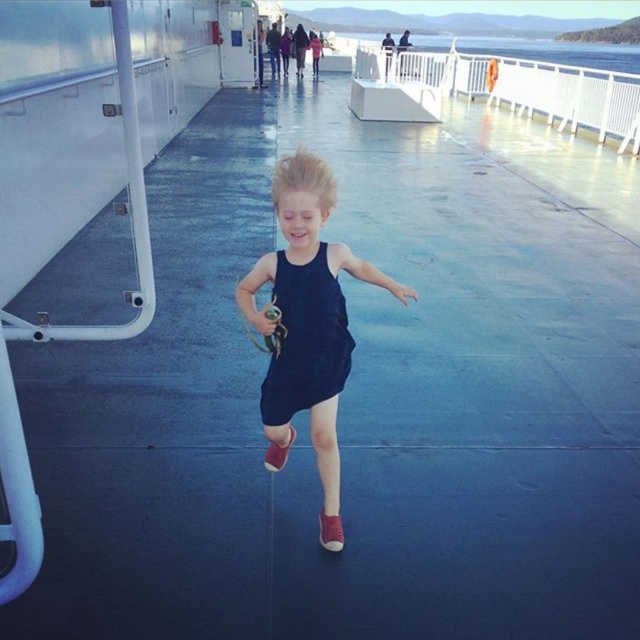
You are standing on the ferry deck and want to walk from the starting point at point (291, 176) to the destination at point (333, 548). Which direction should you move to get closer to your destination?

To move from point (291, 176) to point (333, 548), you should move towards the upper right direction since point (333, 548) is located at a higher x and y coordinate compared to point (291, 176).

You are a photographer trying to capture a child wearing a dress in the center of the ferry deck. There are two dresses available for the child to wear, a navy matte dress at center and a black matte dress at center. Which dress should the child wear to ensure they appear larger in the photo?

The navy matte dress at center has a larger size compared to the black matte dress at center, so the child should wear the navy matte dress at center to appear larger in the photo.

You are a photographer trying to capture the child running on the deck. You notice the navy matte dress at center and the matte red shoe at center. Which object should you focus on first if you want to capture the child moving from left to right?

The navy matte dress at center is to the right of the matte red shoe at center. Since the child is moving from left to right, the matte red shoe at center will come into frame first, so you should focus on it first to capture the movement.